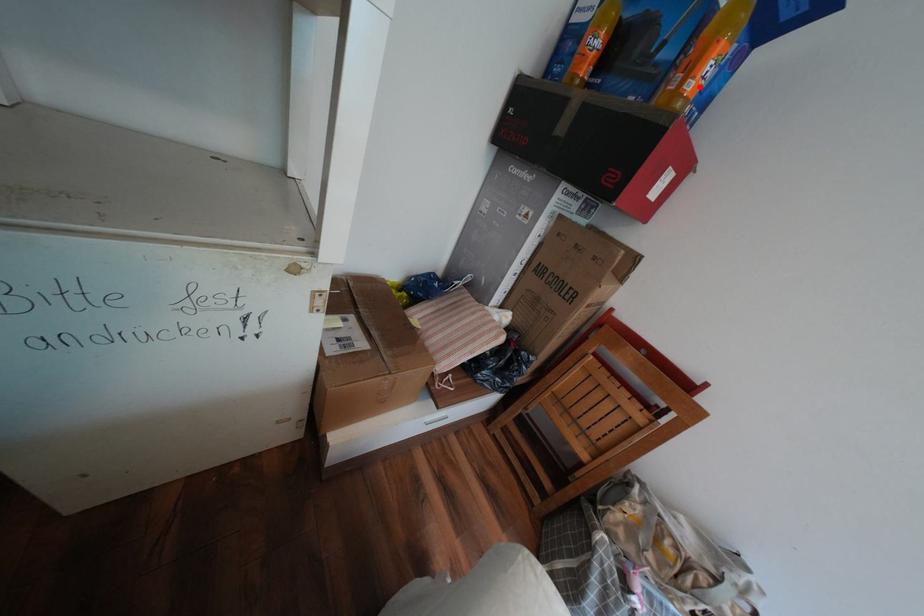
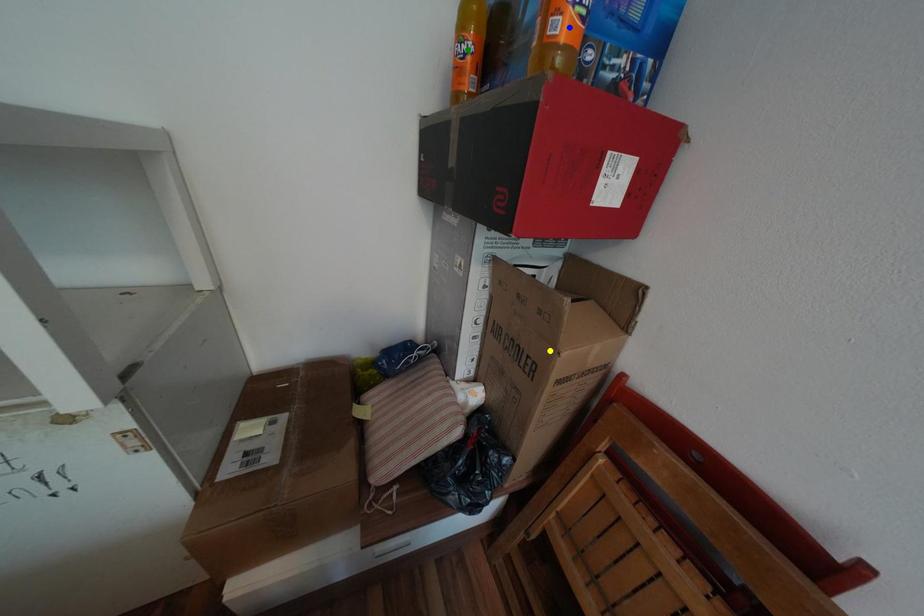
Question: I am providing you with two images of the same scene from different viewpoints. A red point is marked on the first image. You are given multiple points on the second image. Can you choose the point in image 2 that corresponds to the point in image 1?

Choices:
 (A) green point
 (B) yellow point
 (C) blue point

Answer: (C)